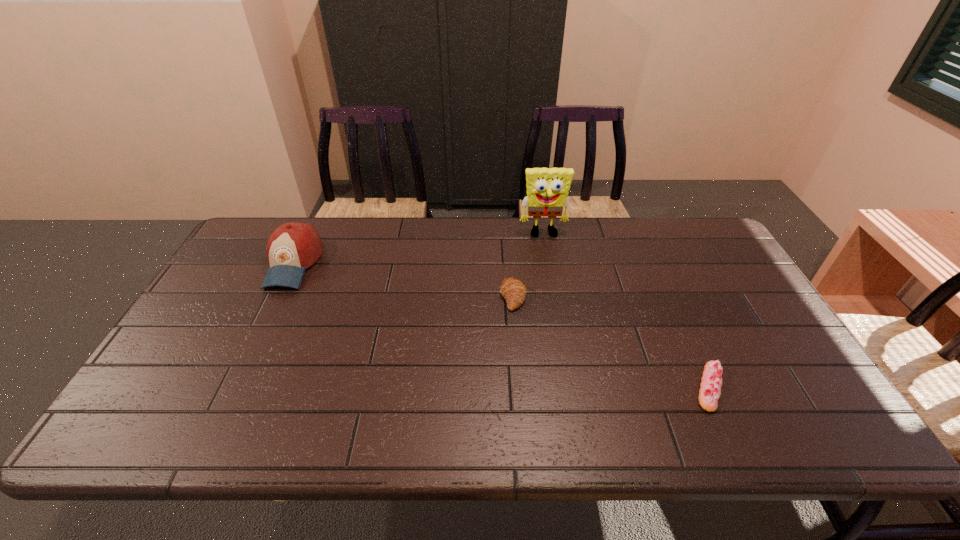
You are a GUI agent. You are given a task and a screenshot of the screen. Output one action in this format:
    pyautogui.click(x=<x>, y=<y>)
    Task: Click on the tallest object
    
    Given the screenshot: What is the action you would take?
    pyautogui.click(x=547, y=188)

The image size is (960, 540). Find the location of `the second tallest object`. the second tallest object is located at coordinates (293, 247).

You are a GUI agent. You are given a task and a screenshot of the screen. Output one action in this format:
    pyautogui.click(x=<x>, y=<y>)
    Task: Click on the leftmost object
    This screenshot has height=540, width=960.
    Given the screenshot: What is the action you would take?
    pyautogui.click(x=293, y=247)

This screenshot has width=960, height=540. What are the coordinates of `crescent roll` in the screenshot? It's located at [x=513, y=290].

The width and height of the screenshot is (960, 540). What are the coordinates of `the rightmost object` in the screenshot? It's located at (711, 382).

Where is `eclair`? eclair is located at coordinates (711, 382).

The height and width of the screenshot is (540, 960). Find the location of `vacant space situated 0.150m on the face of the sponge`. vacant space situated 0.150m on the face of the sponge is located at coordinates (550, 271).

Where is `free space located on the front-facing side of the third shortest object`? free space located on the front-facing side of the third shortest object is located at coordinates (240, 375).

The width and height of the screenshot is (960, 540). In order to click on free space located 0.240m on the right of the crescent roll in this screenshot , I will do `click(610, 296)`.

You are a GUI agent. You are given a task and a screenshot of the screen. Output one action in this format:
    pyautogui.click(x=<x>, y=<y>)
    Task: Click on the free spot located on the left of the shortest object
    This screenshot has height=540, width=960.
    Given the screenshot: What is the action you would take?
    pyautogui.click(x=552, y=387)